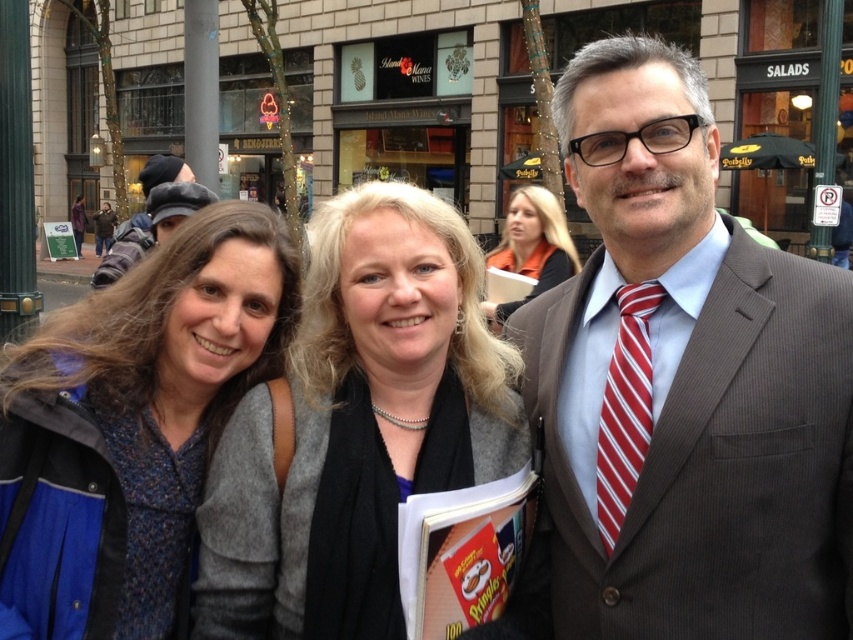
You are a photographer taking a picture of the group. You want to focus on the smooth gray sweater at center. Where should you aim your camera to capture it?

The smooth gray sweater at center is located at the 2D coordinates point (358, 426), so aim your camera at that point to capture it.

You are a photographer trying to capture a clear shot of the brown pinstripe suit at center and the blue textured jacket at left. Since you want to focus on both subjects equally, which one should you adjust your camera angle to prioritize in terms of height?

The brown pinstripe suit at center is much taller than the blue textured jacket at left, so you should lower your camera angle to prioritize the blue textured jacket at left to ensure both are in focus.

You are a photographer taking a picture of the group. You notice the red striped tie at right and the dark gray knit hat at upper left. Which object is located more to the right in the image?

The red striped tie at right is positioned more to the right than the dark gray knit hat at upper left.